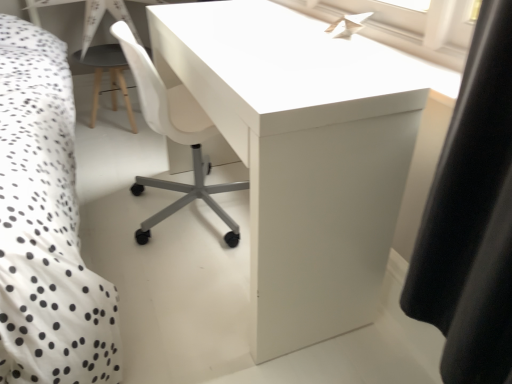
Question: Is white paper airplane at upper center not within white glossy desk at center?

Choices:
 (A) yes
 (B) no

Answer: (A)

Question: Is the depth of white paper airplane at upper center less than that of white glossy desk at center?

Choices:
 (A) yes
 (B) no

Answer: (B)

Question: Is white paper airplane at upper center positioned with its back to white glossy desk at center?

Choices:
 (A) yes
 (B) no

Answer: (B)

Question: Is white paper airplane at upper center smaller than white glossy desk at center?

Choices:
 (A) yes
 (B) no

Answer: (A)

Question: Is white paper airplane at upper center further to camera compared to white glossy desk at center?

Choices:
 (A) no
 (B) yes

Answer: (B)

Question: From their relative heights in the image, would you say white glossy desk at center is taller or shorter than matte gray stool at left?

Choices:
 (A) tall
 (B) short

Answer: (A)

Question: From the image's perspective, is white glossy desk at center above or below matte gray stool at left?

Choices:
 (A) above
 (B) below

Answer: (B)

Question: In the image, is white glossy desk at center on the left side or the right side of matte gray stool at left?

Choices:
 (A) right
 (B) left

Answer: (A)

Question: From a real-world perspective, is white glossy desk at center physically located above or below matte gray stool at left?

Choices:
 (A) below
 (B) above

Answer: (B)

Question: Does point (465, 51) appear closer or farther from the camera than point (349, 307)?

Choices:
 (A) closer
 (B) farther

Answer: (A)

Question: From a real-world perspective, relative to white glossy desk at center, is white paper airplane at upper center vertically above or below?

Choices:
 (A) below
 (B) above

Answer: (B)

Question: Looking at the image, does white paper airplane at upper center seem bigger or smaller compared to white glossy desk at center?

Choices:
 (A) small
 (B) big

Answer: (A)

Question: Is white paper airplane at upper center inside or outside of white glossy desk at center?

Choices:
 (A) inside
 (B) outside

Answer: (B)

Question: From the image's perspective, is white paper airplane at upper center above or below matte gray stool at left?

Choices:
 (A) below
 (B) above

Answer: (A)

Question: Is white paper airplane at upper center in front of or behind matte gray stool at left in the image?

Choices:
 (A) behind
 (B) front

Answer: (B)